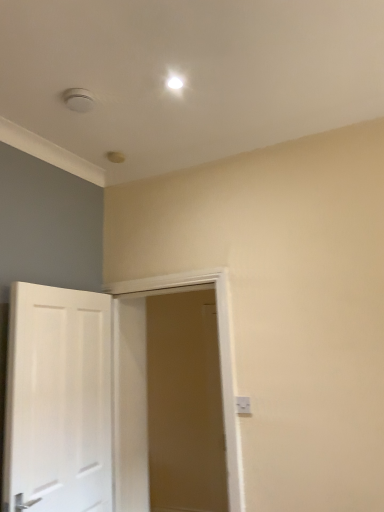
Question: Considering the relative sizes of white wooden door at center, which is the 2th door in left-to-right order, and white plastic electric outlet at lower right in the image provided, is white wooden door at center, which is the 2th door in left-to-right order, shorter than white plastic electric outlet at lower right?

Choices:
 (A) yes
 (B) no

Answer: (B)

Question: Considering the relative positions of white wooden door at center, which is the 2th door in left-to-right order, and white plastic electric outlet at lower right in the image provided, is white wooden door at center, which is the 2th door in left-to-right order, to the left of white plastic electric outlet at lower right from the viewer's perspective?

Choices:
 (A) yes
 (B) no

Answer: (A)

Question: Can you confirm if white wooden door at center, which is the 2th door in left-to-right order, is wider than white plastic electric outlet at lower right?

Choices:
 (A) yes
 (B) no

Answer: (A)

Question: From a real-world perspective, is white wooden door at center, which is the first door in right-to-left order, below white plastic electric outlet at lower right?

Choices:
 (A) no
 (B) yes

Answer: (A)

Question: Can you confirm if white wooden door at center, which is the 2th door in left-to-right order, is taller than white plastic electric outlet at lower right?

Choices:
 (A) yes
 (B) no

Answer: (A)

Question: From a real-world perspective, is white wooden door at center, which is the 2th door in left-to-right order, over white plastic electric outlet at lower right?

Choices:
 (A) yes
 (B) no

Answer: (A)

Question: Can you confirm if white plastic electric outlet at lower right is shorter than white wooden door at center, which is the 2th door in left-to-right order?

Choices:
 (A) no
 (B) yes

Answer: (B)

Question: Is white plastic electric outlet at lower right at the left side of white wooden door at center, which is the first door in right-to-left order?

Choices:
 (A) yes
 (B) no

Answer: (B)

Question: Is white plastic electric outlet at lower right positioned in front of white wooden door at center, which is the first door in right-to-left order?

Choices:
 (A) yes
 (B) no

Answer: (B)

Question: Can you confirm if white plastic electric outlet at lower right is wider than white wooden door at center, which is the 2th door in left-to-right order?

Choices:
 (A) no
 (B) yes

Answer: (A)

Question: From a real-world perspective, is white plastic electric outlet at lower right located beneath white wooden door at center, which is the first door in right-to-left order?

Choices:
 (A) no
 (B) yes

Answer: (B)

Question: Are white plastic electric outlet at lower right and white wooden door at center, which is the 2th door in left-to-right order, located far from each other?

Choices:
 (A) no
 (B) yes

Answer: (B)

Question: Can you confirm if white wooden door at center, which is the first door in right-to-left order, is bigger than white glossy door at left, the 2th door viewed from the right?

Choices:
 (A) yes
 (B) no

Answer: (A)